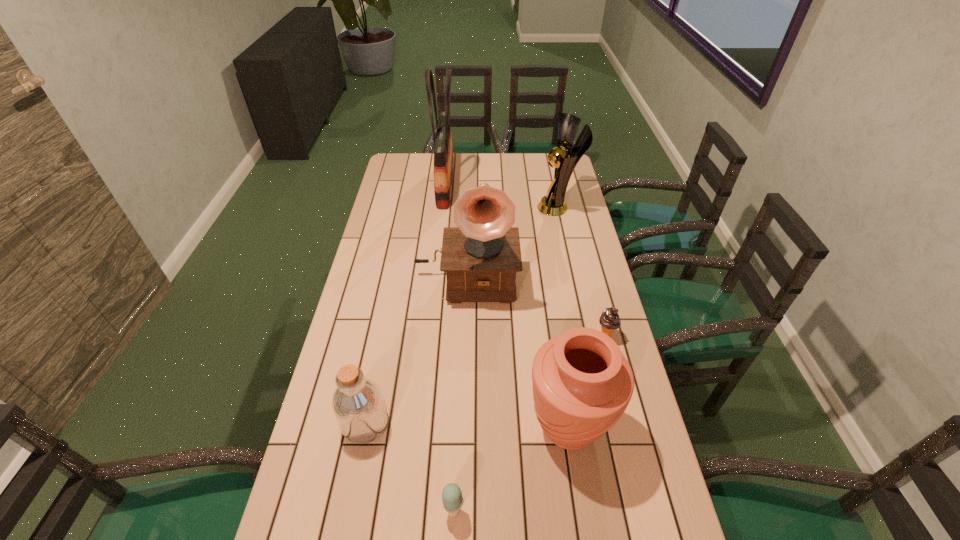
Find the location of a particular element. blank region between the nearer ice cream and the award is located at coordinates (506, 359).

Identify the location of vacant region between the shopping bag and the fourth farthest object. This screenshot has height=540, width=960. (525, 261).

Where is `free space between the third farthest object and the nearest object`? This screenshot has width=960, height=540. free space between the third farthest object and the nearest object is located at coordinates (460, 394).

Where is `vacant space that is in between the fifth nearest object and the leftmost object`? The image size is (960, 540). vacant space that is in between the fifth nearest object and the leftmost object is located at coordinates point(416,350).

This screenshot has width=960, height=540. What are the coordinates of `free space between the shopping bag and the left ice cream` in the screenshot? It's located at (449, 348).

Identify which object is the closest to the fifth nearest object. Please provide its 2D coordinates. Your answer should be formatted as a tuple, i.e. [(x, y)], where the tuple contains the x and y coordinates of a point satisfying the conditions above.

[(553, 204)]

Locate which object ranks sixth in proximity to the nearer ice cream. Please provide its 2D coordinates. Your answer should be formatted as a tuple, i.e. [(x, y)], where the tuple contains the x and y coordinates of a point satisfying the conditions above.

[(443, 151)]

You are a GUI agent. You are given a task and a screenshot of the screen. Output one action in this format:
    pyautogui.click(x=<x>, y=<y>)
    Task: Click on the free space that satisfies the following two spatial constraints: 1. on the horn of the vase; 2. on the right side of the record player
    This screenshot has width=960, height=540.
    Given the screenshot: What is the action you would take?
    pyautogui.click(x=462, y=427)